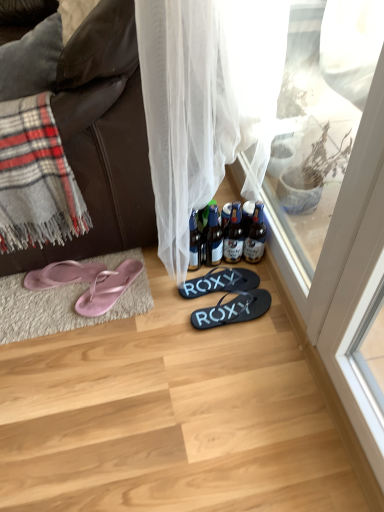
Question: Is gray plaid blanket at left positioned beyond the bounds of translucent glass bottle at center, the 1th bottle positioned from the left?

Choices:
 (A) yes
 (B) no

Answer: (A)

Question: Can you confirm if gray plaid blanket at left is shorter than translucent glass bottle at center, the 1th bottle positioned from the left?

Choices:
 (A) no
 (B) yes

Answer: (A)

Question: Is translucent glass bottle at center, the 4th bottle positioned from the right, a part of gray plaid blanket at left?

Choices:
 (A) no
 (B) yes

Answer: (A)

Question: From the image's perspective, is gray plaid blanket at left located above translucent glass bottle at center, the 4th bottle positioned from the right?

Choices:
 (A) yes
 (B) no

Answer: (A)

Question: Is gray plaid blanket at left aimed at translucent glass bottle at center, the 1th bottle positioned from the left?

Choices:
 (A) yes
 (B) no

Answer: (B)

Question: Looking at the image, does gray plaid blanket at left seem bigger or smaller compared to brown glass bottles at center, which is the 1th bottle in right-to-left order?

Choices:
 (A) small
 (B) big

Answer: (B)

Question: In the image, is gray plaid blanket at left positioned in front of or behind brown glass bottles at center, the 4th bottle in the left-to-right sequence?

Choices:
 (A) front
 (B) behind

Answer: (A)

Question: Which is correct: gray plaid blanket at left is inside brown glass bottles at center, which is the 1th bottle in right-to-left order, or outside of it?

Choices:
 (A) outside
 (B) inside

Answer: (A)

Question: From the image's perspective, relative to brown glass bottles at center, the 4th bottle in the left-to-right sequence, is gray plaid blanket at left above or below?

Choices:
 (A) below
 (B) above

Answer: (B)

Question: Looking at the image, does black rubber flip flops at center, placed as the 2th footwear when sorted from right to left, seem bigger or smaller compared to pink rubber flip-flops at left, the 1th footwear viewed from the left?

Choices:
 (A) big
 (B) small

Answer: (A)

Question: Choose the correct answer: Is black rubber flip flops at center, the third footwear when ordered from left to right, inside pink rubber flip-flops at left, the fourth footwear from the right, or outside it?

Choices:
 (A) inside
 (B) outside

Answer: (B)

Question: Is point (213, 283) positioned closer to the camera than point (94, 276)?

Choices:
 (A) closer
 (B) farther

Answer: (A)

Question: Is black rubber flip flops at center, placed as the 2th footwear when sorted from right to left, in front of or behind pink rubber flip-flops at left, the 1th footwear viewed from the left, in the image?

Choices:
 (A) front
 (B) behind

Answer: (A)

Question: Looking at their shapes, would you say brown glass bottles at center, the 4th bottle in the left-to-right sequence, is wider or thinner than pink rubber flip-flops at left, the fourth footwear from the right?

Choices:
 (A) wide
 (B) thin

Answer: (B)

Question: Is point (251, 243) closer or farther from the camera than point (66, 282)?

Choices:
 (A) closer
 (B) farther

Answer: (B)